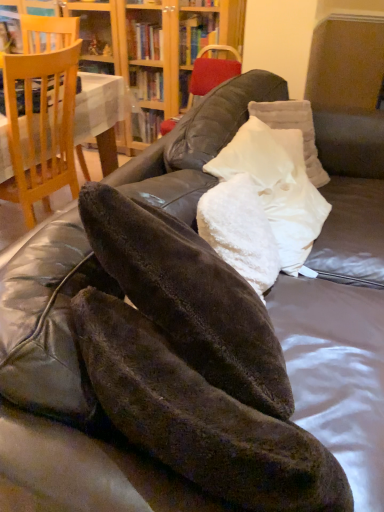
Question: Can you confirm if white fluffy pillow at center, which is the second pillow from front to back, is thinner than light brown wooden chair at left?

Choices:
 (A) yes
 (B) no

Answer: (A)

Question: Does white fluffy pillow at center, which is the second pillow from front to back, lie behind light brown wooden chair at left?

Choices:
 (A) no
 (B) yes

Answer: (A)

Question: Considering the relative positions of white fluffy pillow at center, which is the second pillow from front to back, and light brown wooden chair at left in the image provided, is white fluffy pillow at center, which is the second pillow from front to back, to the right of light brown wooden chair at left from the viewer's perspective?

Choices:
 (A) no
 (B) yes

Answer: (B)

Question: From the image's perspective, is white fluffy pillow at center, the 2th pillow when ordered from back to front, located above light brown wooden chair at left?

Choices:
 (A) yes
 (B) no

Answer: (B)

Question: Is white fluffy pillow at center, the 2th pillow when ordered from back to front, bigger than light brown wooden chair at left?

Choices:
 (A) no
 (B) yes

Answer: (A)

Question: From the image's perspective, does white fluffy pillow at center, the 2th pillow when ordered from back to front, appear lower than light brown wooden chair at left?

Choices:
 (A) yes
 (B) no

Answer: (A)

Question: From the image's perspective, is white fluffy pillow at center, which is the second pillow from front to back, beneath wooden bookcase at upper center?

Choices:
 (A) no
 (B) yes

Answer: (B)

Question: Can you confirm if white fluffy pillow at center, which is the second pillow from front to back, is positioned to the right of wooden bookcase at upper center?

Choices:
 (A) yes
 (B) no

Answer: (A)

Question: Is white fluffy pillow at center, which is the second pillow from front to back, thinner than wooden bookcase at upper center?

Choices:
 (A) no
 (B) yes

Answer: (A)

Question: Considering the relative positions of white fluffy pillow at center, the 2th pillow when ordered from back to front, and wooden bookcase at upper center in the image provided, is white fluffy pillow at center, the 2th pillow when ordered from back to front, in front of wooden bookcase at upper center?

Choices:
 (A) yes
 (B) no

Answer: (A)

Question: Does white fluffy pillow at center, the 2th pillow when ordered from back to front, have a greater height compared to wooden bookcase at upper center?

Choices:
 (A) no
 (B) yes

Answer: (A)

Question: Can wooden bookcase at upper center be found inside white fluffy pillow at center, the 2th pillow when ordered from back to front?

Choices:
 (A) yes
 (B) no

Answer: (B)

Question: From a real-world perspective, is white fluffy pillow at center, which is the second pillow from front to back, positioned under white fluffy pillow at center, the third pillow positioned from the back, based on gravity?

Choices:
 (A) yes
 (B) no

Answer: (B)